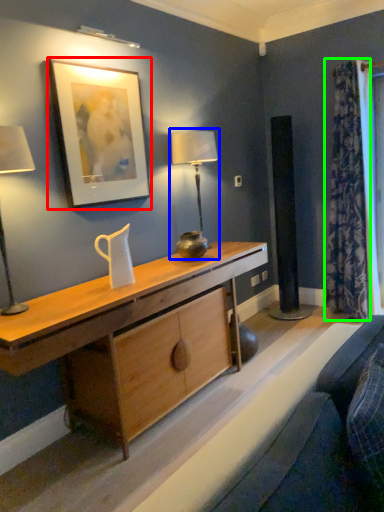
Question: Which object is the closest to the picture frame (highlighted by a red box)? Choose among these: table lamp (highlighted by a blue box) or curtain (highlighted by a green box).

Choices:
 (A) table lamp
 (B) curtain

Answer: (A)